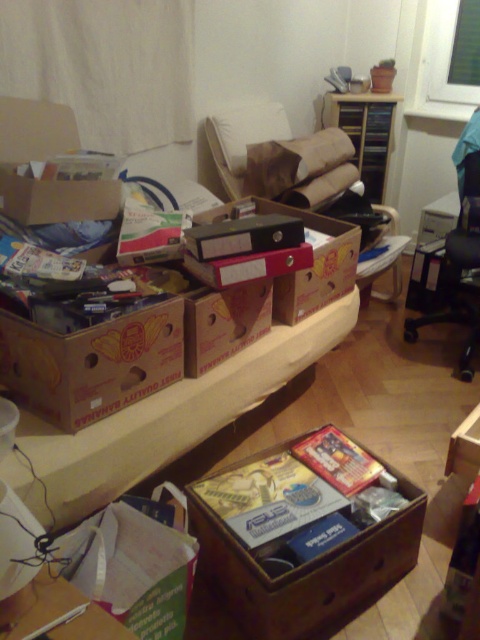
You are organizing a storage area and need to place the brown cardboard box at center and the black plastic swivel chair at right. Given their sizes, which object should you prioritize moving first to ensure efficient space utilization?

The brown cardboard box at center should be moved first because it occupies less space than the black plastic swivel chair at right, allowing for more flexibility in arranging the larger item afterward.

You are organizing items in a storage room and need to place a new box that is 10 inches wide. You see the brown cardboard boxes at center and the brown cardboard box at center. Can you fit the new box between them?

The distance between the brown cardboard boxes at center and the brown cardboard box at center is 7.62 inches, which is less than the width of the new box. Therefore, the new box cannot fit between them.